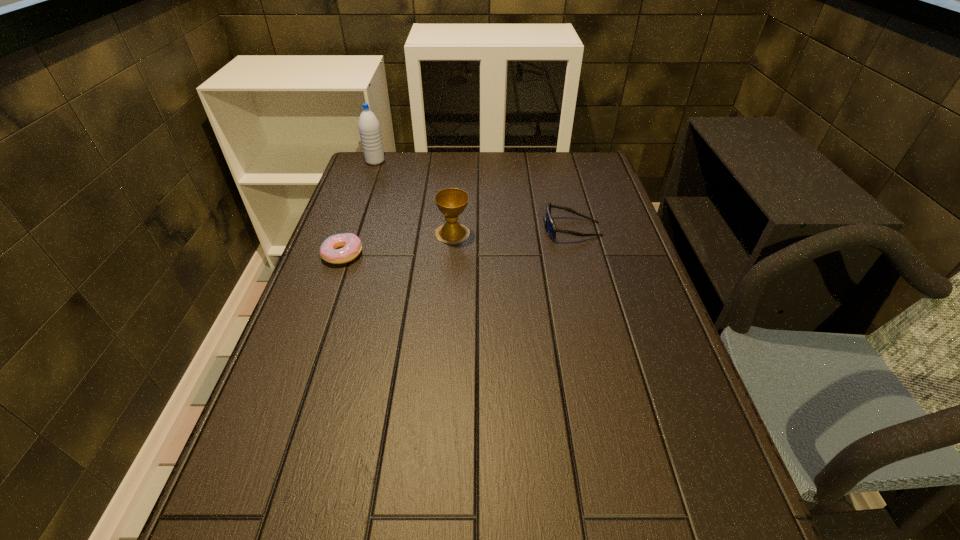
Where is `vacant space located 0.380m on the front-facing side of the rightmost object`? Image resolution: width=960 pixels, height=540 pixels. vacant space located 0.380m on the front-facing side of the rightmost object is located at coordinates (410, 229).

In order to click on free region located 0.260m on the front-facing side of the rightmost object in this screenshot , I will do `click(452, 229)`.

Where is `vacant area located on the front of the shortest object`? This screenshot has height=540, width=960. vacant area located on the front of the shortest object is located at coordinates (300, 370).

Identify the location of object located in the far edge section of the desktop. (369, 128).

Locate an element on the screen. water bottle that is at the left edge is located at coordinates (369, 128).

Find the location of a particular element. doughnut that is at the left edge is located at coordinates (351, 244).

Where is `object situated at the right edge`? The image size is (960, 540). object situated at the right edge is located at coordinates (550, 226).

Identify the location of object that is positioned at the far left corner. This screenshot has height=540, width=960. (369, 128).

The width and height of the screenshot is (960, 540). In order to click on free location at the far edge of the desktop in this screenshot , I will do `click(472, 154)`.

What are the coordinates of `vacant region at the left edge of the desktop` in the screenshot? It's located at (301, 364).